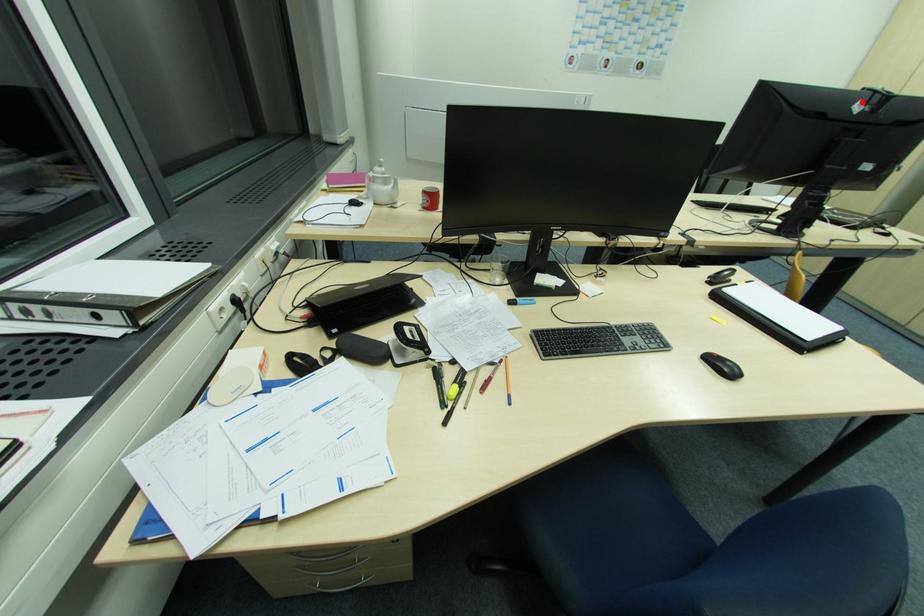
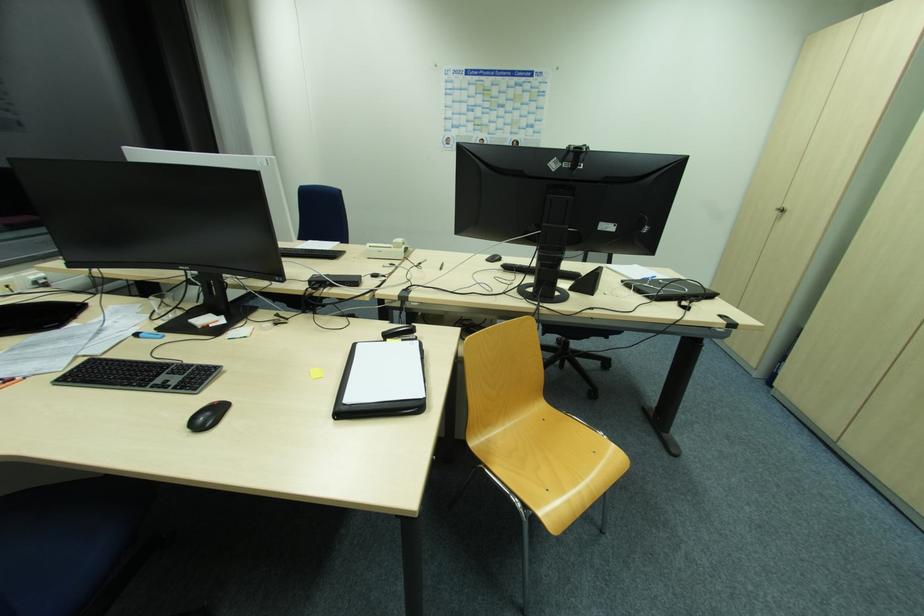
Question: A red point is marked in image1. In image2, is the corresponding 3D point closer to the camera or farther? Reply with the corresponding letter.

Choices:
 (A) The corresponding 3D point is closer.
 (B) The corresponding 3D point is farther.

Answer: (A)